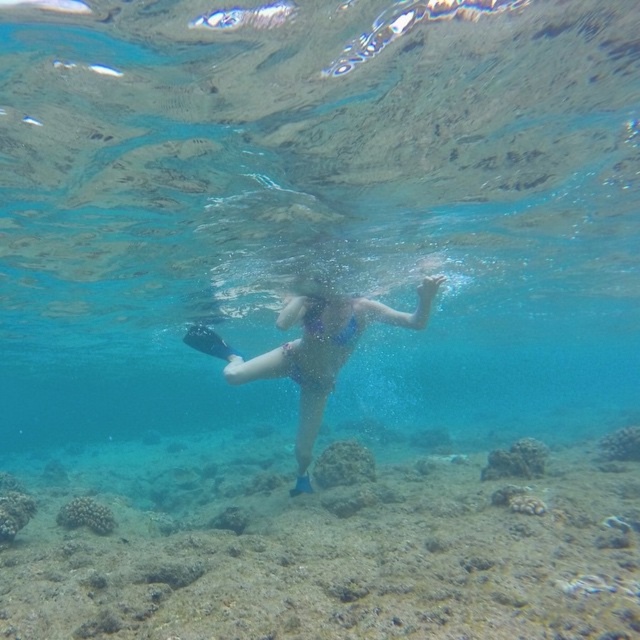
Question: Among these points, which one is farthest from the camera?

Choices:
 (A) (225, 92)
 (B) (323, 397)

Answer: (B)

Question: Which object is the closest to the clear blue water at center?

Choices:
 (A) rough textured coral reef at center
 (B) blue matte swimsuit at center

Answer: (A)

Question: Does clear blue water at center appear under blue matte swimsuit at center?

Choices:
 (A) no
 (B) yes

Answer: (B)

Question: Does clear blue water at center appear on the right side of blue matte swimsuit at center?

Choices:
 (A) yes
 (B) no

Answer: (B)

Question: Is clear blue water at center behind blue matte swimsuit at center?

Choices:
 (A) no
 (B) yes

Answer: (A)

Question: Which object is the farthest from the blue matte swimsuit at center?

Choices:
 (A) clear blue water at center
 (B) rough textured coral reef at center

Answer: (A)